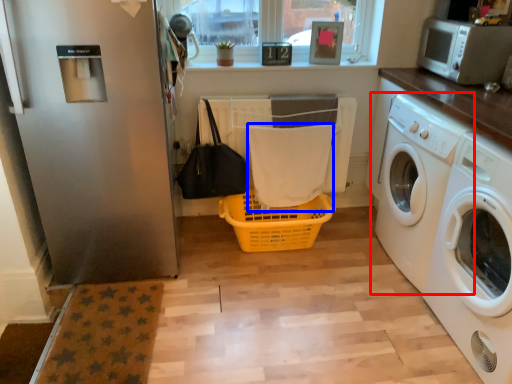
Question: Among these objects, which one is farthest to the camera, washing machine (highlighted by a red box) or bath towel (highlighted by a blue box)?

Choices:
 (A) washing machine
 (B) bath towel

Answer: (B)